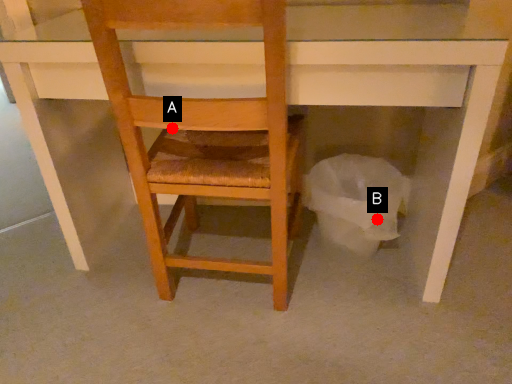
Question: Two points are circled on the image, labeled by A and B beside each circle. Which point is farther to the camera?

Choices:
 (A) A is further
 (B) B is further

Answer: (B)